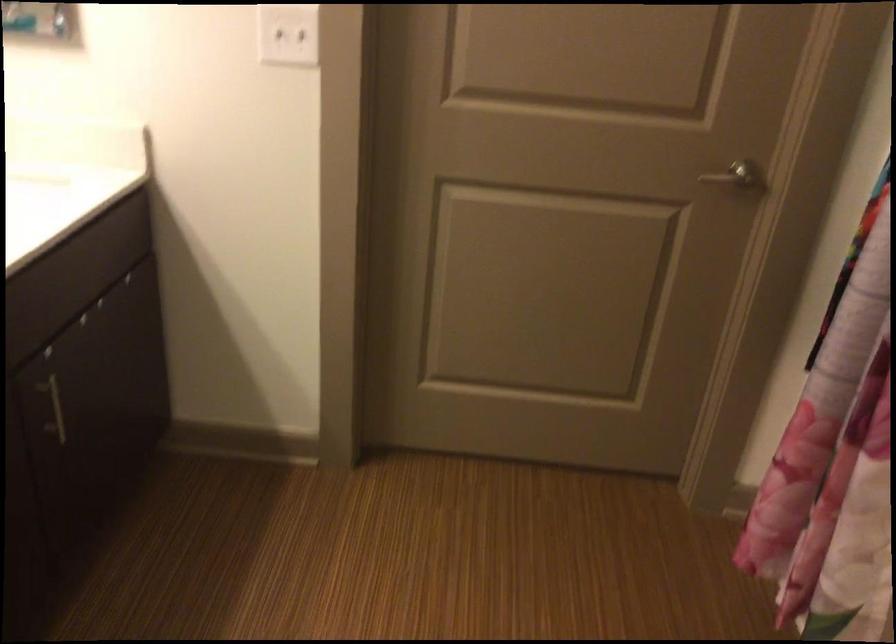
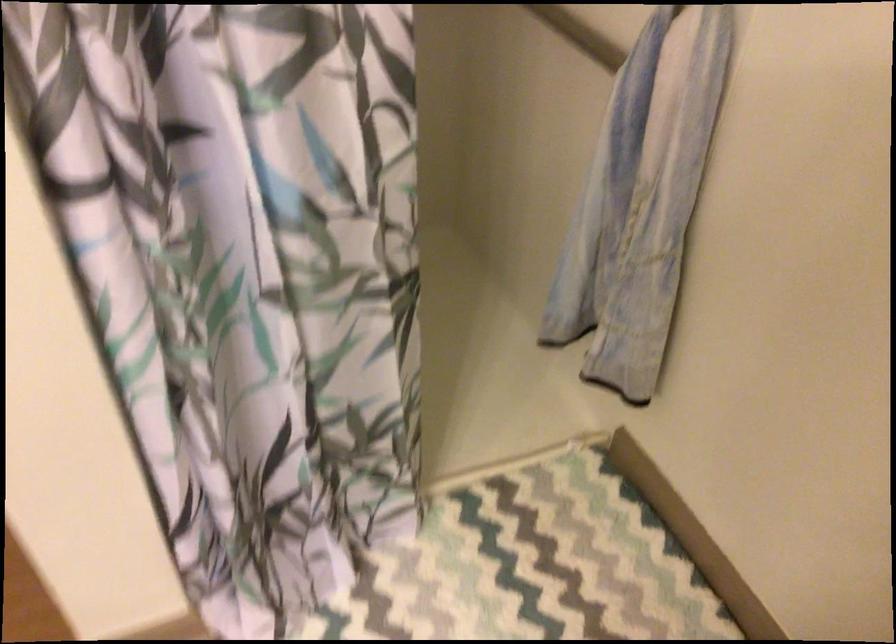
The first image is from the beginning of the video and the second image is from the end. How did the camera likely rotate when shooting the video?

The camera rotated toward right-down.